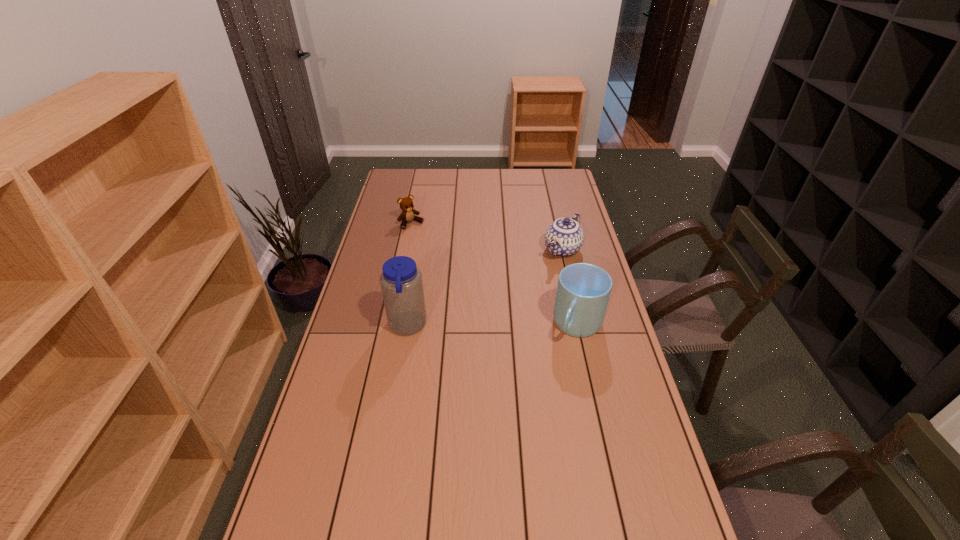
You are a GUI agent. You are given a task and a screenshot of the screen. Output one action in this format:
    pyautogui.click(x=<x>, y=<y>)
    Task: Click on the vacant area between the third nearest object and the farthest object
    
    Given the screenshot: What is the action you would take?
    pyautogui.click(x=487, y=237)

Identify the location of free space between the tallest object and the second farthest object. The image size is (960, 540). (485, 288).

Where is `vacant space in between the third tallest object and the teddy bear`? This screenshot has width=960, height=540. vacant space in between the third tallest object and the teddy bear is located at coordinates (487, 237).

Identify which object is located as the nearest to the third shortest object. Please provide its 2D coordinates. Your answer should be formatted as a tuple, i.e. [(x, y)], where the tuple contains the x and y coordinates of a point satisfying the conditions above.

[(564, 237)]

Select which object is the third closest to the water bottle. Please provide its 2D coordinates. Your answer should be formatted as a tuple, i.e. [(x, y)], where the tuple contains the x and y coordinates of a point satisfying the conditions above.

[(564, 237)]

The width and height of the screenshot is (960, 540). Identify the location of free space that satisfies the following two spatial constraints: 1. on the front side of the tallest object; 2. with a carrying loop on the side of the teddy bear. (390, 326).

Where is `vacant point that satisfies the following two spatial constraints: 1. on the back side of the mug; 2. on the right side of the second farthest object`? vacant point that satisfies the following two spatial constraints: 1. on the back side of the mug; 2. on the right side of the second farthest object is located at coordinates (562, 249).